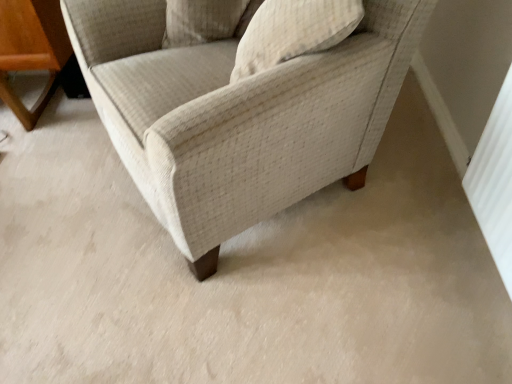
What is the approximate width of textured beige pillow at upper center, the 1th pillow positioned from the right?

It is 13.14 inches.

How much space does beige textured pillow at upper center, acting as the second pillow starting from the right, occupy vertically?

beige textured pillow at upper center, acting as the second pillow starting from the right, is 8.04 inches tall.

Locate an element on the screen. This screenshot has height=384, width=512. textured beige pillow at upper center, which appears as the 2th pillow when viewed from the left is located at coordinates (293, 32).

At what (x,y) coordinates should I click in order to perform the action: click on pillow on the right of the beige fabric chair at center. Please return your answer as a coordinate pair (x, y). This screenshot has height=384, width=512. Looking at the image, I should click on (293, 32).

Which object is closer to the camera taking this photo, textured beige pillow at upper center, which appears as the 2th pillow when viewed from the left, or beige fabric chair at center?

beige fabric chair at center is more forward.

Is textured beige pillow at upper center, the 1th pillow positioned from the right, inside the boundaries of beige fabric chair at center, or outside?

textured beige pillow at upper center, the 1th pillow positioned from the right, is located inside beige fabric chair at center.

Based on the photo, is textured beige pillow at upper center, the 1th pillow positioned from the right, oriented away from beige fabric chair at center?

Yes, textured beige pillow at upper center, the 1th pillow positioned from the right, is facing away from beige fabric chair at center.

In the scene shown: From a real-world perspective, is textured beige pillow at upper center, which appears as the 2th pillow when viewed from the left, physically below beige textured pillow at upper center, acting as the second pillow starting from the right?

Incorrect, from a real-world perspective, textured beige pillow at upper center, which appears as the 2th pillow when viewed from the left, is higher than beige textured pillow at upper center, acting as the second pillow starting from the right.

How many degrees apart are the facing directions of textured beige pillow at upper center, the 1th pillow positioned from the right, and beige textured pillow at upper center, the first pillow viewed from the left?

textured beige pillow at upper center, the 1th pillow positioned from the right, and beige textured pillow at upper center, the first pillow viewed from the left, are facing 112 degrees away from each other.

Where is `pillow located on the right of beige textured pillow at upper center, the first pillow viewed from the left`? Image resolution: width=512 pixels, height=384 pixels. pillow located on the right of beige textured pillow at upper center, the first pillow viewed from the left is located at coordinates (293, 32).

Which of these two, textured beige pillow at upper center, the 1th pillow positioned from the right, or beige textured pillow at upper center, the first pillow viewed from the left, stands shorter?

beige textured pillow at upper center, the first pillow viewed from the left, is shorter.

Which object is thinner, beige fabric chair at center or textured beige pillow at upper center, the 1th pillow positioned from the right?

With smaller width is textured beige pillow at upper center, the 1th pillow positioned from the right.

Are beige fabric chair at center and textured beige pillow at upper center, which appears as the 2th pillow when viewed from the left, making contact?

beige fabric chair at center is not next to textured beige pillow at upper center, which appears as the 2th pillow when viewed from the left, and they're not touching.

From the image's perspective, relative to textured beige pillow at upper center, which appears as the 2th pillow when viewed from the left, is beige fabric chair at center above or below?

beige fabric chair at center is situated lower than textured beige pillow at upper center, which appears as the 2th pillow when viewed from the left, in the image.

Is textured beige pillow at upper center, which appears as the 2th pillow when viewed from the left, surrounded by beige fabric chair at center?

Yes, textured beige pillow at upper center, which appears as the 2th pillow when viewed from the left, is a part of beige fabric chair at center.

Considering the positions of objects beige textured pillow at upper center, acting as the second pillow starting from the right, and textured beige pillow at upper center, the 1th pillow positioned from the right, in the image provided, who is more to the left, beige textured pillow at upper center, acting as the second pillow starting from the right, or textured beige pillow at upper center, the 1th pillow positioned from the right,?

Positioned to the left is beige textured pillow at upper center, acting as the second pillow starting from the right.

Is beige textured pillow at upper center, acting as the second pillow starting from the right, positioned before textured beige pillow at upper center, which appears as the 2th pillow when viewed from the left?

No.

From a real-world perspective, who is located lower, beige textured pillow at upper center, the first pillow viewed from the left, or textured beige pillow at upper center, the 1th pillow positioned from the right?

beige textured pillow at upper center, the first pillow viewed from the left.

Is beige textured pillow at upper center, the first pillow viewed from the left, aimed at textured beige pillow at upper center, the 1th pillow positioned from the right?

Yes, beige textured pillow at upper center, the first pillow viewed from the left, is turned towards textured beige pillow at upper center, the 1th pillow positioned from the right.

Consider the image. Is beige fabric chair at center wider or thinner than beige textured pillow at upper center, the first pillow viewed from the left?

Considering their sizes, beige fabric chair at center looks broader than beige textured pillow at upper center, the first pillow viewed from the left.

From a real-world perspective, who is located lower, beige fabric chair at center or beige textured pillow at upper center, acting as the second pillow starting from the right?

beige fabric chair at center.

Between beige fabric chair at center and beige textured pillow at upper center, acting as the second pillow starting from the right, which one has larger size?

beige fabric chair at center.

Based on the photo, is beige fabric chair at center situated inside beige textured pillow at upper center, acting as the second pillow starting from the right, or outside?

beige fabric chair at center exists outside the volume of beige textured pillow at upper center, acting as the second pillow starting from the right.

Which object is closer to the camera taking this photo, beige textured pillow at upper center, acting as the second pillow starting from the right, or beige fabric chair at center?

beige fabric chair at center.

From the image's perspective, does beige textured pillow at upper center, the first pillow viewed from the left, appear higher than beige fabric chair at center?

Yes, from the image's perspective, beige textured pillow at upper center, the first pillow viewed from the left, is above beige fabric chair at center.

Is beige textured pillow at upper center, acting as the second pillow starting from the right, at the left side of beige fabric chair at center?

Yes.

Which of these two, beige textured pillow at upper center, the first pillow viewed from the left, or beige fabric chair at center, stands shorter?

beige textured pillow at upper center, the first pillow viewed from the left, is shorter.

The image size is (512, 384). I want to click on pillow that is the 1st one when counting upward from the beige fabric chair at center (from the image's perspective), so click(x=293, y=32).

Image resolution: width=512 pixels, height=384 pixels. There is a beige textured pillow at upper center, acting as the second pillow starting from the right. What are the coordinates of `pillow above it (from a real-world perspective)` in the screenshot? It's located at (293, 32).

Looking at the image, which one is located closer to beige textured pillow at upper center, acting as the second pillow starting from the right, textured beige pillow at upper center, the 1th pillow positioned from the right, or beige fabric chair at center?

The object closer to beige textured pillow at upper center, acting as the second pillow starting from the right, is textured beige pillow at upper center, the 1th pillow positioned from the right.

In the scene shown: Looking at the image, which one is located further to textured beige pillow at upper center, which appears as the 2th pillow when viewed from the left, beige fabric chair at center or beige textured pillow at upper center, the first pillow viewed from the left?

Based on the image, beige textured pillow at upper center, the first pillow viewed from the left, appears to be further to textured beige pillow at upper center, which appears as the 2th pillow when viewed from the left.

When comparing their distances from beige fabric chair at center, does beige textured pillow at upper center, the first pillow viewed from the left, or textured beige pillow at upper center, the 1th pillow positioned from the right, seem closer?

Based on the image, textured beige pillow at upper center, the 1th pillow positioned from the right, appears to be nearer to beige fabric chair at center.

Looking at the image, which one is located closer to textured beige pillow at upper center, the 1th pillow positioned from the right, beige textured pillow at upper center, acting as the second pillow starting from the right, or beige fabric chair at center?

beige fabric chair at center is closer to textured beige pillow at upper center, the 1th pillow positioned from the right.

From the image, which object appears to be nearer to beige fabric chair at center, textured beige pillow at upper center, which appears as the 2th pillow when viewed from the left, or beige textured pillow at upper center, the first pillow viewed from the left?

Among the two, textured beige pillow at upper center, which appears as the 2th pillow when viewed from the left, is located nearer to beige fabric chair at center.

Estimate the real-world distances between objects in this image. Which object is further from beige textured pillow at upper center, acting as the second pillow starting from the right, beige fabric chair at center or textured beige pillow at upper center, which appears as the 2th pillow when viewed from the left?

Among the two, beige fabric chair at center is located further to beige textured pillow at upper center, acting as the second pillow starting from the right.

Find the location of `pillow between beige fabric chair at center and beige textured pillow at upper center, acting as the second pillow starting from the right, in the front-back direction`. pillow between beige fabric chair at center and beige textured pillow at upper center, acting as the second pillow starting from the right, in the front-back direction is located at coordinates (293, 32).